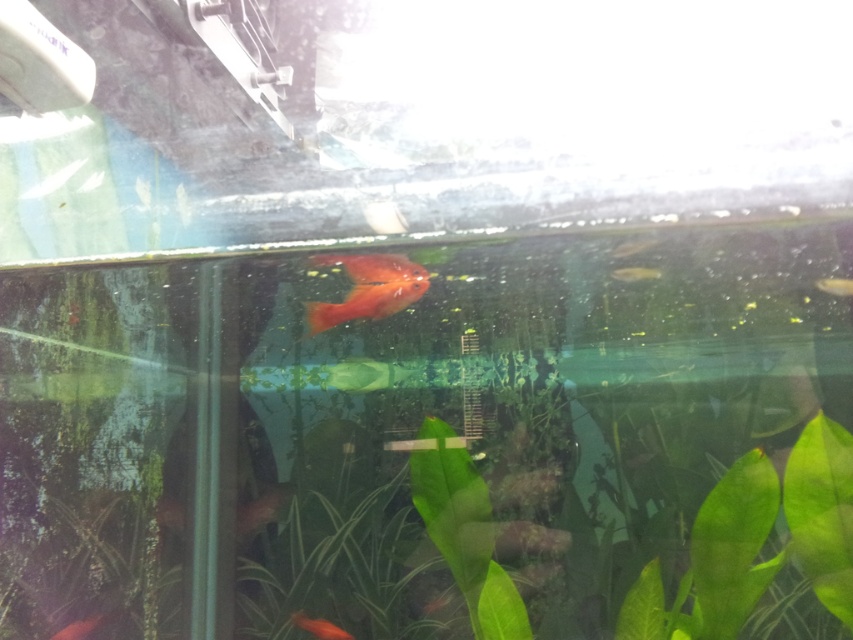
You are a photographer trying to capture a closeup shot of the glossy orange goldfish at center. Given that your camera requires the subject to be within 3 feet for optimal focus, will you be able to achieve a clear photo without moving the camera?

The glossy orange goldfish at center is 5.00 feet away from the camera, which is beyond the 3 feet requirement for optimal focus. Therefore, you will not be able to achieve a clear photo without moving the camera closer.

You are an aquarist trying to determine the distance between the two orange fish in the aquarium. According to the image, how far apart are the glossy orange goldfish at center and the shiny orange fish at center?

The glossy orange goldfish at center is 15.25 inches away from the shiny orange fish at center.